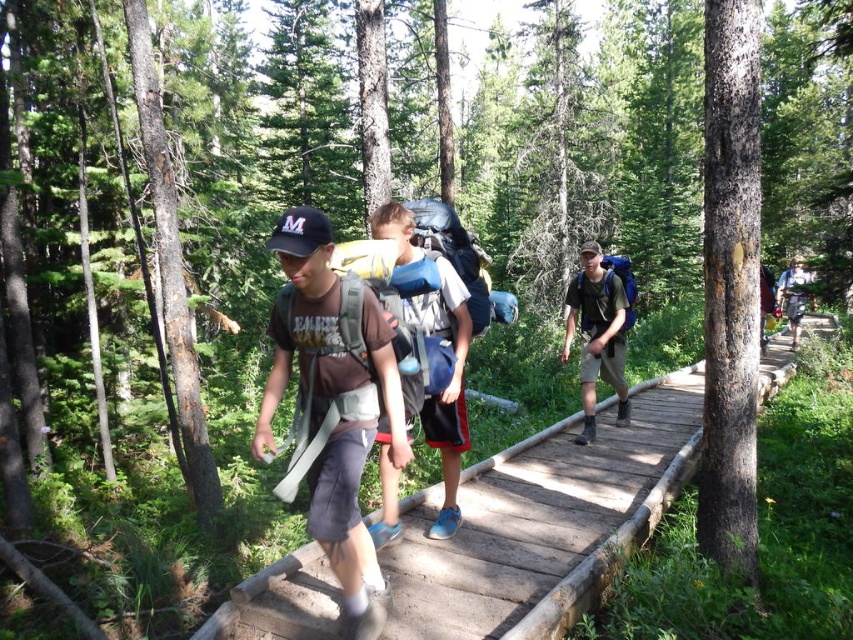
Question: Can you confirm if wooden bridge at center is smaller than matte gray backpack at center?

Choices:
 (A) yes
 (B) no

Answer: (A)

Question: Which point is farther to the camera?

Choices:
 (A) matte gray backpack at center
 (B) wooden bridge at center
 (C) matte green backpack at center

Answer: (C)

Question: Where is wooden bridge at center located in relation to matte green backpack at center in the image?

Choices:
 (A) above
 (B) below

Answer: (B)

Question: Which of the following is the closest to the observer?

Choices:
 (A) (611, 330)
 (B) (415, 593)

Answer: (B)

Question: Which point is farther to the camera?

Choices:
 (A) (670, 412)
 (B) (566, 314)
 (C) (315, 509)

Answer: (B)

Question: Can you confirm if wooden bridge at center is wider than matte green backpack at center?

Choices:
 (A) yes
 (B) no

Answer: (B)